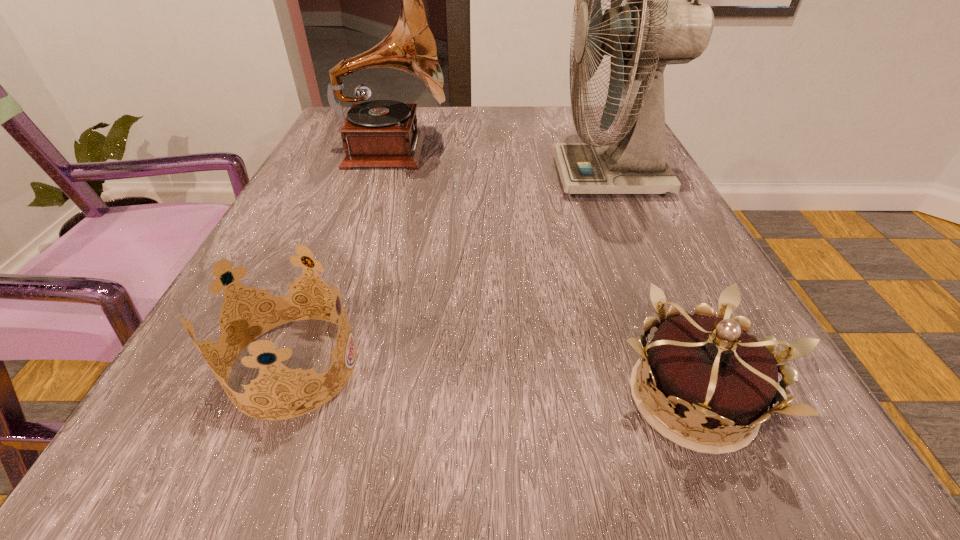
Identify the location of the tallest object. This screenshot has width=960, height=540. (647, 35).

The image size is (960, 540). Identify the location of the second tallest object. (380, 133).

You are a GUI agent. You are given a task and a screenshot of the screen. Output one action in this format:
    pyautogui.click(x=<x>, y=<y>)
    Task: Click on the left crown
    
    Given the screenshot: What is the action you would take?
    pyautogui.click(x=231, y=303)

Image resolution: width=960 pixels, height=540 pixels. I want to click on the right crown, so click(708, 369).

Find the location of a particular element. vacant area situated on the front-facing side of the tallest object is located at coordinates (490, 178).

Image resolution: width=960 pixels, height=540 pixels. Identify the location of vacant position located 0.160m on the front-facing side of the tallest object. (479, 178).

In order to click on vacant space located on the front-facing side of the tallest object in this screenshot , I will do `click(445, 178)`.

Locate an element on the screen. vacant space positioned on the horn of the third shortest object is located at coordinates (590, 152).

The width and height of the screenshot is (960, 540). In order to click on vacant space located 0.070m on the front of the left crown in this screenshot , I will do `click(249, 483)`.

Find the location of a particular element. The height and width of the screenshot is (540, 960). vacant space located on the back of the right crown is located at coordinates (612, 205).